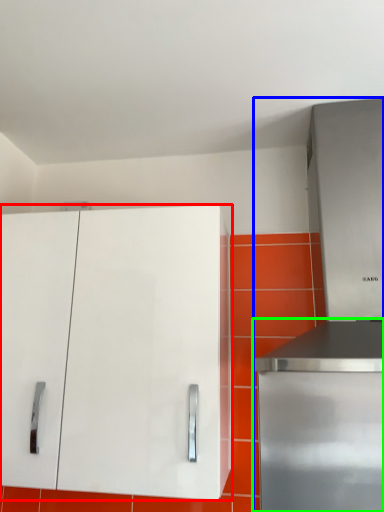
Question: Based on their relative distances, which object is farther from cabinetry (highlighted by a red box)? Choose from appliance (highlighted by a blue box) and home appliance (highlighted by a green box).

Choices:
 (A) appliance
 (B) home appliance

Answer: (B)